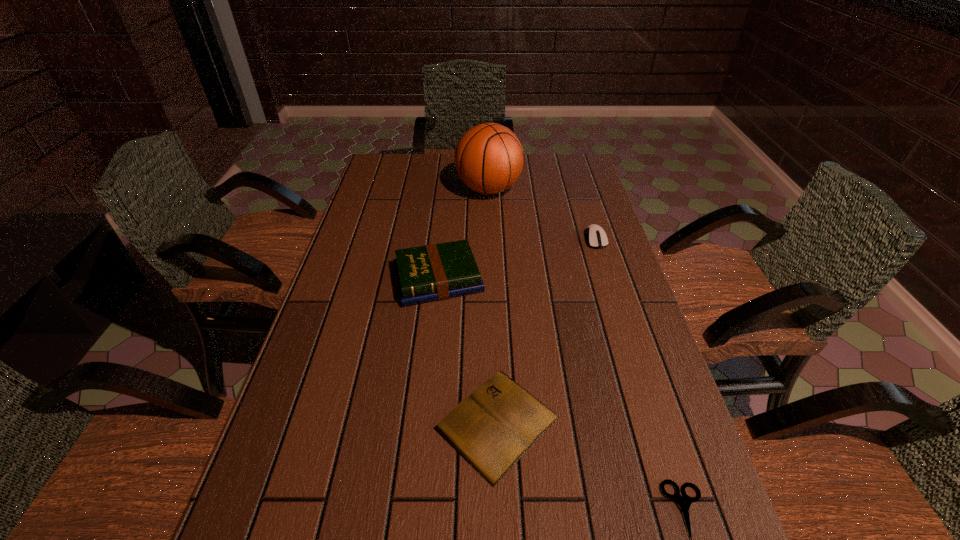
Image resolution: width=960 pixels, height=540 pixels. In order to click on empty space between the taller book and the nearer book in this screenshot , I will do `click(468, 351)`.

The image size is (960, 540). I want to click on vacant space that is in between the nearer book and the mouse, so click(546, 331).

This screenshot has height=540, width=960. In order to click on vacant area that lies between the taller book and the second shortest object in this screenshot , I will do `click(468, 351)`.

Identify the location of free space between the fourth shortest object and the shorter book. The height and width of the screenshot is (540, 960). [x=468, y=351].

You are a GUI agent. You are given a task and a screenshot of the screen. Output one action in this format:
    pyautogui.click(x=<x>, y=<y>)
    Task: Click on the free space between the taller book and the basketball
    The height and width of the screenshot is (540, 960).
    Given the screenshot: What is the action you would take?
    pyautogui.click(x=464, y=234)

Image resolution: width=960 pixels, height=540 pixels. Identify the location of vacant region between the shorter book and the mouse. (546, 331).

Locate an element on the screen. Image resolution: width=960 pixels, height=540 pixels. free area in between the third shortest object and the nearer book is located at coordinates (546, 331).

Identify which object is the second closest to the farther book. Please provide its 2D coordinates. Your answer should be formatted as a tuple, i.e. [(x, y)], where the tuple contains the x and y coordinates of a point satisfying the conditions above.

[(489, 158)]

Identify the location of object that ranks as the fourth closest to the shortest object. (489, 158).

The height and width of the screenshot is (540, 960). What are the coordinates of `free point that satisfies the following two spatial constraints: 1. on the back side of the fourth shortest object; 2. on the right side of the third shortest object` in the screenshot? It's located at (443, 239).